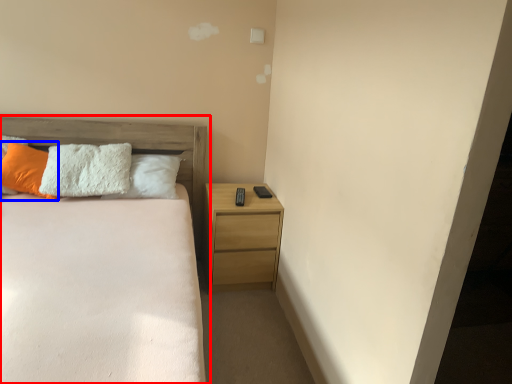
Question: Which of the following is the farthest to the observer, bed (highlighted by a red box) or pillow (highlighted by a blue box)?

Choices:
 (A) bed
 (B) pillow

Answer: (B)